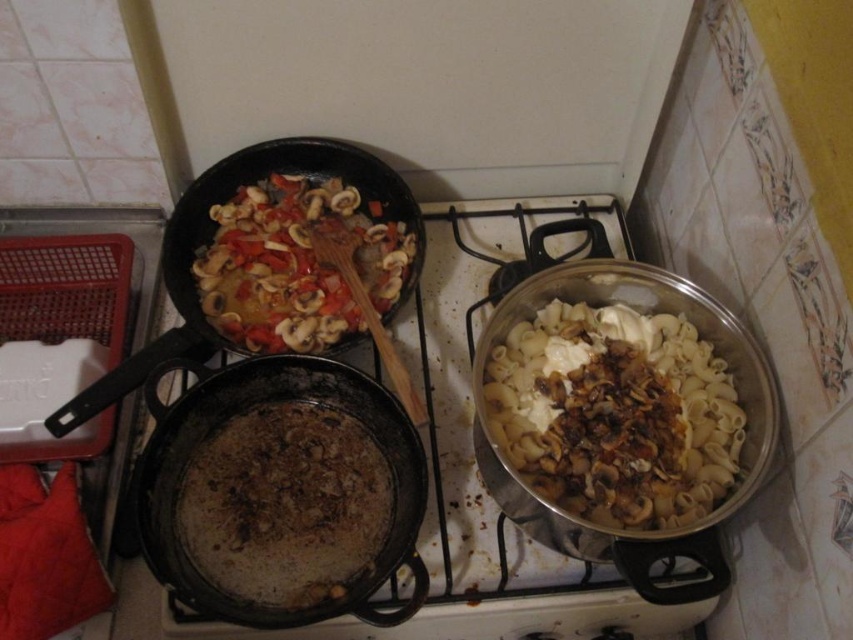
Question: Which point is farther to the camera?

Choices:
 (A) (291, 244)
 (B) (192, 211)
 (C) (364, 560)
 (D) (544, 358)

Answer: (B)

Question: Is black cast iron wok at center positioned before shiny black wok at upper left?

Choices:
 (A) yes
 (B) no

Answer: (A)

Question: Does black cast iron wok at center have a greater width compared to slightly browned wooden spoon at upper left?

Choices:
 (A) no
 (B) yes

Answer: (B)

Question: Which of these objects is positioned farthest from the black cast iron wok at center?

Choices:
 (A) shiny black wok at upper left
 (B) white glossy pasta at center right

Answer: (B)

Question: Does slightly browned wooden spoon at upper left appear on the left side of shiny black wok at upper left?

Choices:
 (A) no
 (B) yes

Answer: (A)

Question: Estimate the real-world distances between objects in this image. Which object is farther from the white glossy pasta at center right?

Choices:
 (A) shiny black wok at upper left
 (B) black cast iron wok at center
 (C) slightly browned wooden spoon at upper left

Answer: (A)